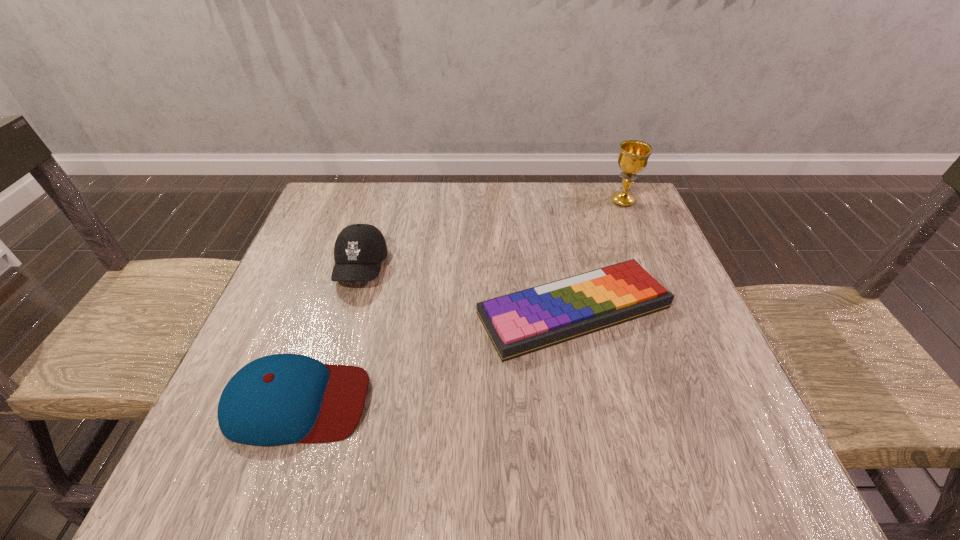
This screenshot has height=540, width=960. In the image, there is a desktop. Find the location of `vacant space at the right edge`. vacant space at the right edge is located at coordinates (634, 334).

In the image, there is a desktop. Identify the location of vacant region at the far left corner. This screenshot has height=540, width=960. coord(348,187).

The height and width of the screenshot is (540, 960). I want to click on blank space at the far right corner of the desktop, so click(x=626, y=208).

Locate an element on the screen. The height and width of the screenshot is (540, 960). vacant area at the near right corner of the desktop is located at coordinates (713, 476).

Image resolution: width=960 pixels, height=540 pixels. I want to click on free space between the farther baseball cap and the nearer baseball cap, so point(328,335).

This screenshot has height=540, width=960. I want to click on free space between the second tallest object and the chalice, so click(x=492, y=234).

This screenshot has width=960, height=540. I want to click on empty space that is in between the nearer baseball cap and the farthest object, so click(460, 301).

Identify the location of vacant area that lies between the shortest object and the chalice. This screenshot has width=960, height=540. (598, 256).

Where is `vacant area that lies between the second tallest object and the second shortest object`? vacant area that lies between the second tallest object and the second shortest object is located at coordinates (328, 335).

This screenshot has width=960, height=540. I want to click on free space between the second tallest object and the shortest object, so click(468, 289).